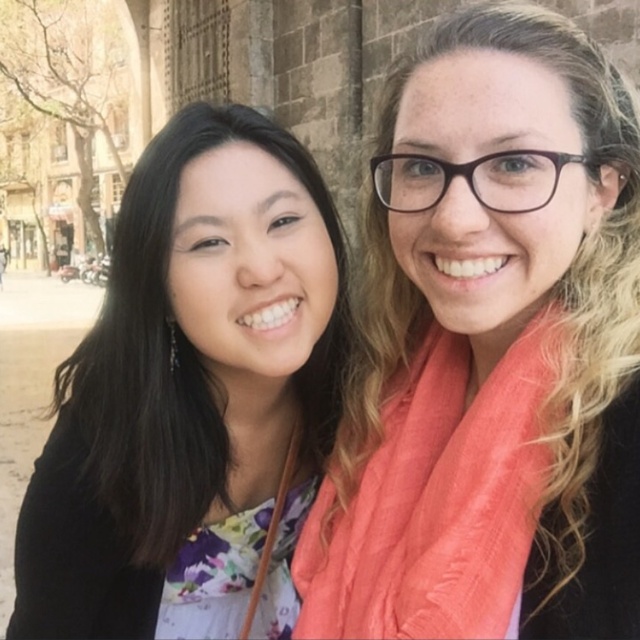
Between floral fabric dress at center and coral silk scarf at right, which one appears on the right side from the viewer's perspective?

coral silk scarf at right is more to the right.

Does floral fabric dress at center come in front of coral silk scarf at right?

No, floral fabric dress at center is behind coral silk scarf at right.

Who is more distant from viewer, (179, 113) or (372, 481)?

The point (179, 113) is behind.

Where is `floral fabric dress at center`? The width and height of the screenshot is (640, 640). floral fabric dress at center is located at coordinates (186, 378).

Does coral scarf at right have a greater height compared to coral silk scarf at right?

Yes, coral scarf at right is taller than coral silk scarf at right.

Is coral scarf at right smaller than coral silk scarf at right?

Incorrect, coral scarf at right is not smaller in size than coral silk scarf at right.

Does point (424, 214) come behind point (513, 531)?

Yes.

This screenshot has width=640, height=640. I want to click on coral scarf at right, so click(492, 349).

Who is lower down, coral scarf at right or floral fabric dress at center?

floral fabric dress at center is below.

Image resolution: width=640 pixels, height=640 pixels. Find the location of `coral scarf at right`. coral scarf at right is located at coordinates point(492,349).

Describe the element at coordinates (492, 349) in the screenshot. The height and width of the screenshot is (640, 640). I see `coral scarf at right` at that location.

Locate an element on the screen. This screenshot has width=640, height=640. coral scarf at right is located at coordinates (492, 349).